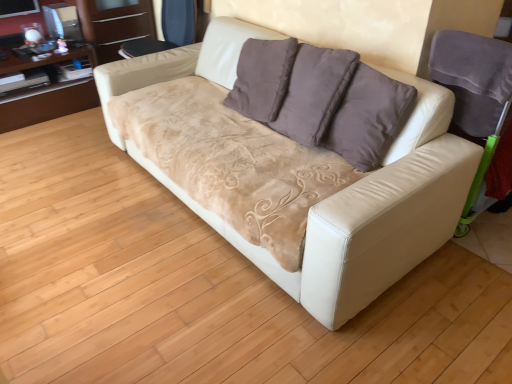
The height and width of the screenshot is (384, 512). What do you see at coordinates (167, 30) in the screenshot?
I see `velvet dark blue armchair at upper center, which is counted as the 2th armchair, starting from the front` at bounding box center [167, 30].

Describe the element at coordinates (46, 103) in the screenshot. The image size is (512, 384). I see `brown wood dresser at upper left, the 2th dresser positioned from the right` at that location.

In order to click on white leather couch at center in this screenshot , I will do `click(356, 209)`.

Where is `velvet dark blue armchair at upper center, which ranks as the 1th armchair in back-to-front order`? The image size is (512, 384). velvet dark blue armchair at upper center, which ranks as the 1th armchair in back-to-front order is located at coordinates 167,30.

From a real-world perspective, who is located higher, velvet dark blue armchair at upper center, which ranks as the 1th armchair in back-to-front order, or brown wood dresser at upper left, which ranks as the first dresser in left-to-right order?

From a 3D spatial view, velvet dark blue armchair at upper center, which ranks as the 1th armchair in back-to-front order, is above.

Between point (175, 41) and point (62, 82), which one is positioned behind?

Point (62, 82)

Considering the sizes of objects velvet dark blue armchair at upper center, which is counted as the 2th armchair, starting from the front, and brown wood dresser at upper left, which ranks as the first dresser in left-to-right order, in the image provided, who is taller, velvet dark blue armchair at upper center, which is counted as the 2th armchair, starting from the front, or brown wood dresser at upper left, which ranks as the first dresser in left-to-right order,?

brown wood dresser at upper left, which ranks as the first dresser in left-to-right order.

Which object is further away from the camera, white leather armchair at right, which appears as the 1th armchair when viewed from the front, or matte brown wood dresser at upper left, placed as the 1th dresser when sorted from right to left?

matte brown wood dresser at upper left, placed as the 1th dresser when sorted from right to left.

Between white leather armchair at right, the second armchair positioned from the back, and matte brown wood dresser at upper left, which is counted as the 2th dresser, starting from the left, which one has larger width?

white leather armchair at right, the second armchair positioned from the back.

Consider the image. Is white leather armchair at right, the second armchair positioned from the top, at the left side of matte brown wood dresser at upper left, placed as the 1th dresser when sorted from right to left?

Incorrect, white leather armchair at right, the second armchair positioned from the top, is not on the left side of matte brown wood dresser at upper left, placed as the 1th dresser when sorted from right to left.

Is white leather armchair at right, which appears as the 1th armchair when ordered from the bottom, facing away from matte brown wood dresser at upper left, which is counted as the 2th dresser, starting from the left?

No, white leather armchair at right, which appears as the 1th armchair when ordered from the bottom,'s orientation is not away from matte brown wood dresser at upper left, which is counted as the 2th dresser, starting from the left.

Which of these two, matte brown wood dresser at upper left, which is counted as the 2th dresser, starting from the left, or white leather couch at center, stands taller?

Standing taller between the two is white leather couch at center.

From a real-world perspective, who is located lower, matte brown wood dresser at upper left, which is counted as the 2th dresser, starting from the left, or white leather couch at center?

white leather couch at center is physically lower.

In the scene shown: Is matte brown wood dresser at upper left, which is counted as the 2th dresser, starting from the left, facing towards white leather couch at center?

Yes, matte brown wood dresser at upper left, which is counted as the 2th dresser, starting from the left, is aimed at white leather couch at center.

Considering the relative positions of white leather couch at center and white leather armchair at right, the second armchair positioned from the back, in the image provided, is white leather couch at center to the left or to the right of white leather armchair at right, the second armchair positioned from the back,?

Based on their positions, white leather couch at center is located to the left of white leather armchair at right, the second armchair positioned from the back.

Could you tell me if white leather couch at center is turned towards white leather armchair at right, the second armchair positioned from the top?

No, white leather couch at center is not aimed at white leather armchair at right, the second armchair positioned from the top.

Locate an element on the screen. The height and width of the screenshot is (384, 512). studio couch beneath the white leather armchair at right, the second armchair positioned from the back (from a real-world perspective) is located at coordinates (356, 209).

Can you confirm if white leather armchair at right, the second armchair when ordered from left to right, is bigger than white leather couch at center?

No, white leather armchair at right, the second armchair when ordered from left to right, is not bigger than white leather couch at center.

Does white leather armchair at right, the second armchair when ordered from left to right, have a lesser height compared to white leather couch at center?

Yes, white leather armchair at right, the second armchair when ordered from left to right, is shorter than white leather couch at center.

I want to click on armchair below the white leather couch at center (from the image's perspective), so click(x=475, y=95).

Is velvet dark blue armchair at upper center, arranged as the first armchair when viewed from the left, positioned far away from white leather couch at center?

Indeed, velvet dark blue armchair at upper center, arranged as the first armchair when viewed from the left, is not near white leather couch at center.

Considering the points (164, 13) and (211, 218), which point is in front, point (164, 13) or point (211, 218)?

Point (211, 218)

In the image, there is a velvet dark blue armchair at upper center, the 2th armchair positioned from the right. Identify the location of studio couch below it (from a real-world perspective). (356, 209).

Does velvet dark blue armchair at upper center, which ranks as the 1th armchair in top-to-bottom order, come behind white leather couch at center?

Yes, velvet dark blue armchair at upper center, which ranks as the 1th armchair in top-to-bottom order, is further from the camera.

Is brown wood dresser at upper left, which ranks as the first dresser in left-to-right order, thinner than white leather couch at center?

Indeed, brown wood dresser at upper left, which ranks as the first dresser in left-to-right order, has a lesser width compared to white leather couch at center.

Which is in front, brown wood dresser at upper left, which ranks as the first dresser in left-to-right order, or white leather couch at center?

white leather couch at center.

From a real-world perspective, is brown wood dresser at upper left, the 2th dresser positioned from the right, above or below white leather couch at center?

From a real-world perspective, brown wood dresser at upper left, the 2th dresser positioned from the right, is physically below white leather couch at center.

Is brown wood dresser at upper left, which ranks as the first dresser in left-to-right order, oriented towards white leather couch at center?

Yes, brown wood dresser at upper left, which ranks as the first dresser in left-to-right order, is aimed at white leather couch at center.

Which dresser is the 1st one when counting from the back of the velvet dark blue armchair at upper center, the second armchair in the bottom-to-top sequence? Please provide its 2D coordinates.

[(46, 103)]

In order to click on the 2nd armchair in front of the matte brown wood dresser at upper left, which is counted as the 2th dresser, starting from the left in this screenshot , I will do `click(475, 95)`.

Which object lies nearer to the anchor point matte brown wood dresser at upper left, which is counted as the 2th dresser, starting from the left, white leather armchair at right, placed as the first armchair when sorted from right to left, or white leather couch at center?

The object closer to matte brown wood dresser at upper left, which is counted as the 2th dresser, starting from the left, is white leather couch at center.

From the image, which object appears to be nearer to velvet dark blue armchair at upper center, the second armchair in the bottom-to-top sequence, brown wood dresser at upper left, the 2th dresser positioned from the right, or white leather armchair at right, placed as the first armchair when sorted from right to left?

brown wood dresser at upper left, the 2th dresser positioned from the right.

From the picture: From the image, which object appears to be nearer to velvet dark blue armchair at upper center, which ranks as the 1th armchair in back-to-front order, brown wood dresser at upper left, the 2th dresser positioned from the right, or matte brown wood dresser at upper left, placed as the 1th dresser when sorted from right to left?

matte brown wood dresser at upper left, placed as the 1th dresser when sorted from right to left, lies closer to velvet dark blue armchair at upper center, which ranks as the 1th armchair in back-to-front order, than the other object.

Based on the photo, estimate the real-world distances between objects in this image. Which object is further from brown wood dresser at upper left, the 2th dresser positioned from the right, matte brown wood dresser at upper left, which is counted as the 2th dresser, starting from the left, or velvet dark blue armchair at upper center, which ranks as the 1th armchair in top-to-bottom order?

Based on the image, velvet dark blue armchair at upper center, which ranks as the 1th armchair in top-to-bottom order, appears to be further to brown wood dresser at upper left, the 2th dresser positioned from the right.

Which object lies nearer to the anchor point brown wood dresser at upper left, which ranks as the first dresser in left-to-right order, white leather couch at center or matte brown wood dresser at upper left, which is counted as the 2th dresser, starting from the left?

Among the two, matte brown wood dresser at upper left, which is counted as the 2th dresser, starting from the left, is located nearer to brown wood dresser at upper left, which ranks as the first dresser in left-to-right order.

Estimate the real-world distances between objects in this image. Which object is closer to matte brown wood dresser at upper left, which is counted as the 2th dresser, starting from the left, velvet dark blue armchair at upper center, which is counted as the 2th armchair, starting from the front, or white leather armchair at right, placed as the first armchair when sorted from right to left?

velvet dark blue armchair at upper center, which is counted as the 2th armchair, starting from the front, is positioned closer to the anchor matte brown wood dresser at upper left, which is counted as the 2th dresser, starting from the left.

Which object lies further to the anchor point velvet dark blue armchair at upper center, which is counted as the 2th armchair, starting from the front, white leather armchair at right, the second armchair when ordered from left to right, or white leather couch at center?

white leather armchair at right, the second armchair when ordered from left to right, is positioned further to the anchor velvet dark blue armchair at upper center, which is counted as the 2th armchair, starting from the front.

Estimate the real-world distances between objects in this image. Which object is closer to white leather armchair at right, which appears as the 1th armchair when ordered from the bottom, matte brown wood dresser at upper left, placed as the 1th dresser when sorted from right to left, or brown wood dresser at upper left, which ranks as the first dresser in left-to-right order?

The object closer to white leather armchair at right, which appears as the 1th armchair when ordered from the bottom, is matte brown wood dresser at upper left, placed as the 1th dresser when sorted from right to left.

Locate an element on the screen. The height and width of the screenshot is (384, 512). dresser between white leather couch at center and matte brown wood dresser at upper left, placed as the 1th dresser when sorted from right to left, along the z-axis is located at coordinates (46, 103).

At what (x,y) coordinates should I click in order to perform the action: click on studio couch between velvet dark blue armchair at upper center, arranged as the first armchair when viewed from the left, and white leather armchair at right, which appears as the 1th armchair when viewed from the front. Please return your answer as a coordinate pair (x, y). The width and height of the screenshot is (512, 384). Looking at the image, I should click on (356, 209).

What are the coordinates of `studio couch located between matte brown wood dresser at upper left, placed as the 1th dresser when sorted from right to left, and white leather armchair at right, the second armchair positioned from the top, in the left-right direction` in the screenshot? It's located at (356, 209).

The height and width of the screenshot is (384, 512). Identify the location of studio couch between brown wood dresser at upper left, the 2th dresser positioned from the right, and white leather armchair at right, placed as the first armchair when sorted from right to left. (356, 209).